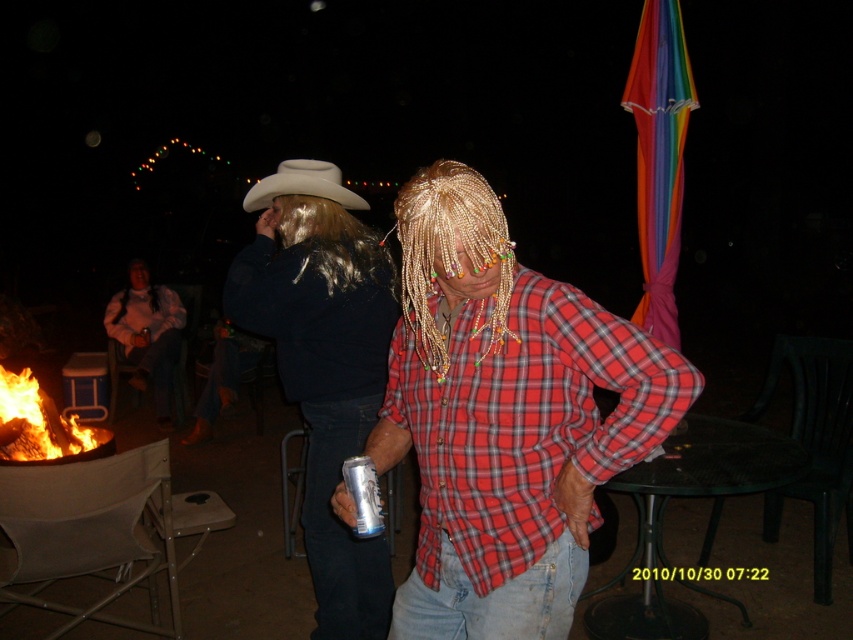
Which is behind, point (467, 236) or point (277, 179)?

Positioned behind is point (277, 179).

Between point (427, 305) and point (309, 173), which one is positioned in front?

Positioned in front is point (427, 305).

Which is behind, point (498, 289) or point (271, 189)?

Point (271, 189)

Where is `golden braided hair at center`? This screenshot has height=640, width=853. golden braided hair at center is located at coordinates (450, 252).

Between shiny brown hair at upper center and white felt cowboy hat at upper center, which one has less height?

white felt cowboy hat at upper center

Can you confirm if shiny brown hair at upper center is shorter than white felt cowboy hat at upper center?

In fact, shiny brown hair at upper center may be taller than white felt cowboy hat at upper center.

Between point (337, 250) and point (300, 188), which one is positioned in front?

Point (337, 250)

Locate an element on the screen. This screenshot has width=853, height=640. shiny brown hair at upper center is located at coordinates (331, 241).

Who is more forward, (480, 474) or (460, 164)?

Point (480, 474) is in front.

Is red plaid shirt at center wider than golden braided hair at center?

Yes.

Locate an element on the screen. This screenshot has height=640, width=853. red plaid shirt at center is located at coordinates (525, 420).

Where is `red plaid shirt at center`? red plaid shirt at center is located at coordinates (525, 420).